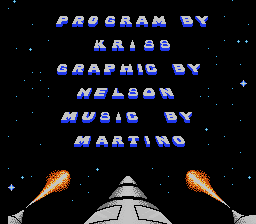
Where is `windows`? This screenshot has height=224, width=256. windows is located at coordinates (99, 214), (149, 213).